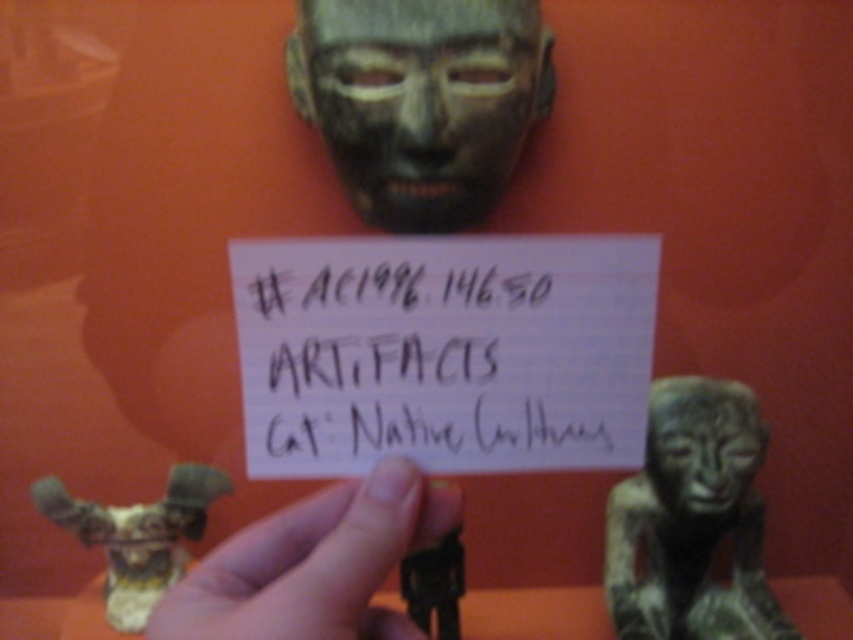
Does bronze mask at center appear on the left side of matte black hand at center?

Incorrect, bronze mask at center is not on the left side of matte black hand at center.

The width and height of the screenshot is (853, 640). In order to click on bronze mask at center in this screenshot , I will do `click(421, 100)`.

Which is in front, point (392, 83) or point (231, 604)?

Point (231, 604)

Where is `bronze mask at center`? This screenshot has height=640, width=853. bronze mask at center is located at coordinates (421, 100).

Measure the distance between point (540,324) and camera.

Point (540,324) is 17.32 inches from camera.

Is point (270, 356) positioned behind point (445, 209)?

No, it is in front of (445, 209).

Does point (447, 388) come farther from viewer compared to point (473, 8)?

No, (447, 388) is in front of (473, 8).

Identify the location of black paper at center. The height and width of the screenshot is (640, 853). (439, 355).

Describe the element at coordinates (439, 355) in the screenshot. This screenshot has height=640, width=853. I see `black paper at center` at that location.

This screenshot has height=640, width=853. I want to click on black paper at center, so click(x=439, y=355).